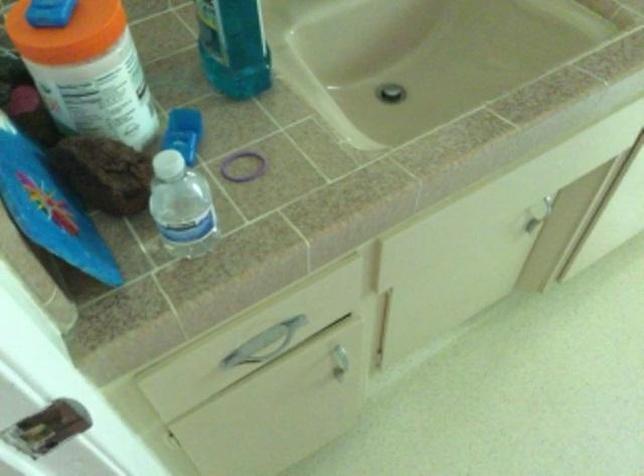
In order to click on blue fliptop lid in this screenshot , I will do [x=46, y=205].